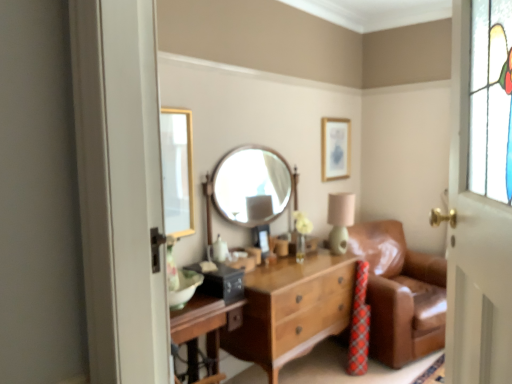
Identify the location of vacant space underneath matte green table lamp at center (from a real-world perspective). The image size is (512, 384). (335, 254).